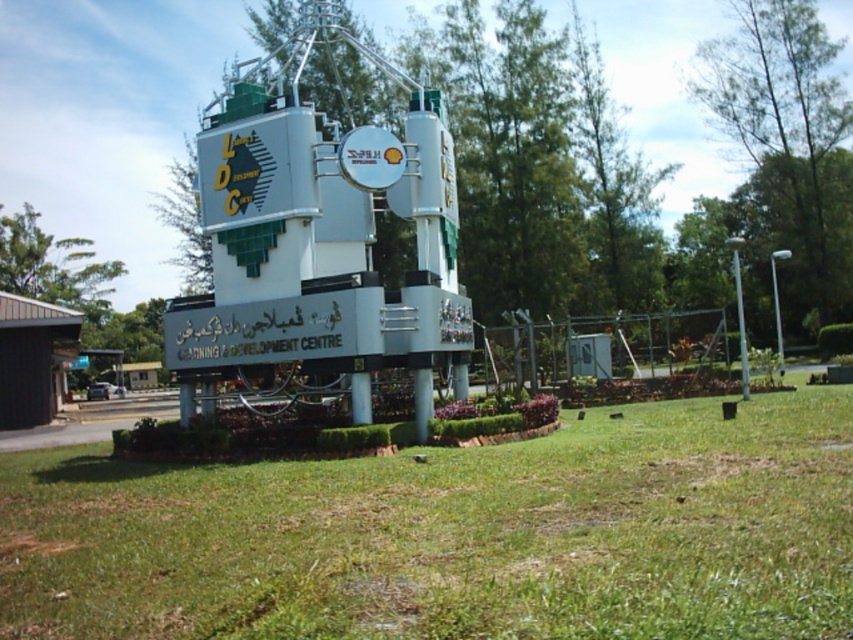
Question: Which of the following is the farthest from the observer?

Choices:
 (A) (206, 340)
 (B) (622, 488)

Answer: (A)

Question: Can you confirm if green grass at center is positioned to the left of white metallic water tower at center?

Choices:
 (A) yes
 (B) no

Answer: (B)

Question: Where is green grass at center located in relation to white metallic water tower at center in the image?

Choices:
 (A) above
 (B) below

Answer: (B)

Question: Which object appears farthest from the camera in this image?

Choices:
 (A) green grass at center
 (B) white metallic water tower at center

Answer: (B)

Question: Is green grass at center wider than white metallic water tower at center?

Choices:
 (A) yes
 (B) no

Answer: (B)

Question: Which object is farther from the camera taking this photo?

Choices:
 (A) white metallic water tower at center
 (B) green grass at center

Answer: (A)